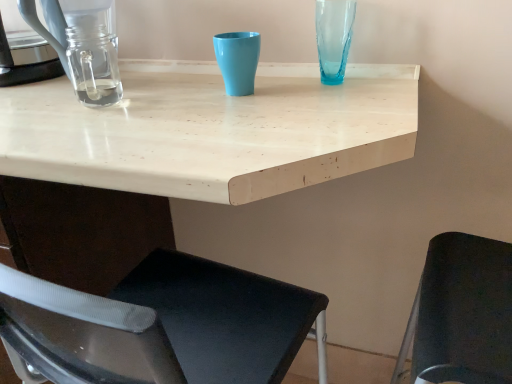
Question: Is translucent blue glass vase at upper right to the right of clear glass coffeepot at left from the viewer's perspective?

Choices:
 (A) no
 (B) yes

Answer: (B)

Question: Considering the relative positions of translucent blue glass vase at upper right and clear glass coffeepot at left in the image provided, is translucent blue glass vase at upper right behind clear glass coffeepot at left?

Choices:
 (A) no
 (B) yes

Answer: (B)

Question: Is clear glass coffeepot at left a part of translucent blue glass vase at upper right?

Choices:
 (A) yes
 (B) no

Answer: (B)

Question: From the image's perspective, is translucent blue glass vase at upper right above clear glass coffeepot at left?

Choices:
 (A) no
 (B) yes

Answer: (A)

Question: Does translucent blue glass vase at upper right have a lesser height compared to clear glass coffeepot at left?

Choices:
 (A) yes
 (B) no

Answer: (A)

Question: From a real-world perspective, is white matte table at center positioned above or below matte plastic cup at center?

Choices:
 (A) above
 (B) below

Answer: (B)

Question: Is point (35, 87) positioned closer to the camera than point (224, 61)?

Choices:
 (A) farther
 (B) closer

Answer: (A)

Question: Based on their positions, is white matte table at center located to the left or right of matte plastic cup at center?

Choices:
 (A) right
 (B) left

Answer: (B)

Question: Is white matte table at center inside or outside of matte plastic cup at center?

Choices:
 (A) inside
 (B) outside

Answer: (B)

Question: Considering the positions of clear glass jar at left and matte plastic cup at center in the image, is clear glass jar at left wider or thinner than matte plastic cup at center?

Choices:
 (A) thin
 (B) wide

Answer: (B)

Question: Considering the relative positions of clear glass jar at left and matte plastic cup at center in the image provided, is clear glass jar at left to the left or to the right of matte plastic cup at center?

Choices:
 (A) left
 (B) right

Answer: (A)

Question: Is clear glass jar at left in front of or behind matte plastic cup at center in the image?

Choices:
 (A) behind
 (B) front

Answer: (A)

Question: Is clear glass jar at left inside or outside of matte plastic cup at center?

Choices:
 (A) inside
 (B) outside

Answer: (B)

Question: Is clear glass jar at left wider or thinner than clear glass coffeepot at left?

Choices:
 (A) thin
 (B) wide

Answer: (B)

Question: From a real-world perspective, is clear glass jar at left positioned above or below clear glass coffeepot at left?

Choices:
 (A) above
 (B) below

Answer: (B)